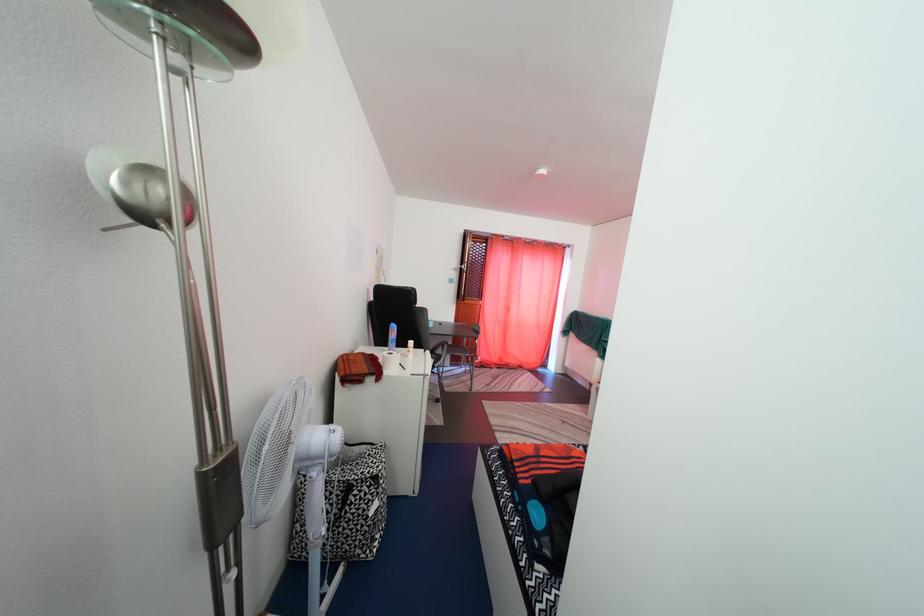
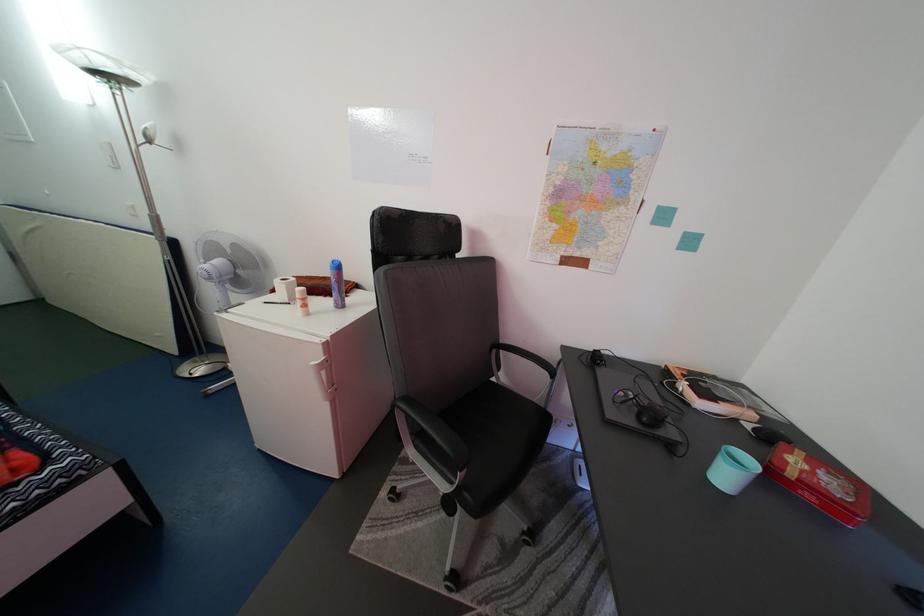
In the second image, find the point that corresponds to (440,331) in the first image.

(735, 484)